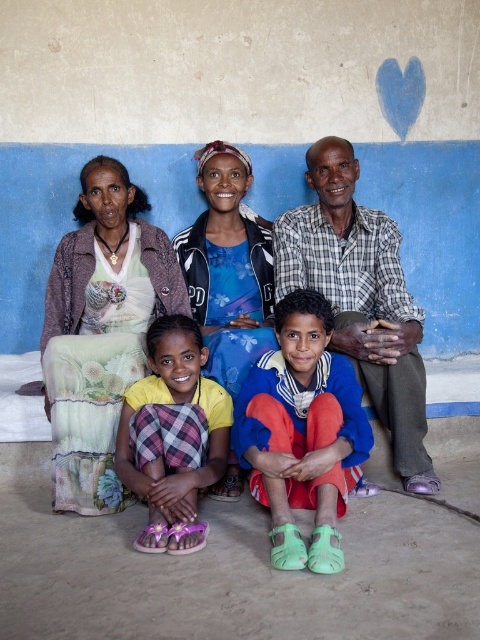
You are a photographer setting up a shoot for a clothing brand. You have two outfits to showcase in the image provided. The first is the matte black jacket at center and the second is the checkered fabric shirt at center. The brand wants to highlight the height difference between the two outfits. Based on the scene description, which outfit appears taller in the image?

The matte black jacket at center appears taller than the checkered fabric shirt at center in the image.

You are a photographer standing 1.5 meters away from the blue fabric pants at lower center. You want to take a photo of the entire group without moving the subjects. Can you step back to capture everyone in the frame?

The subjects are 2.14 meters apart. Since you are already 1.5 meters away from the blue fabric pants at lower center, stepping back further may allow you to capture the entire group in the frame.